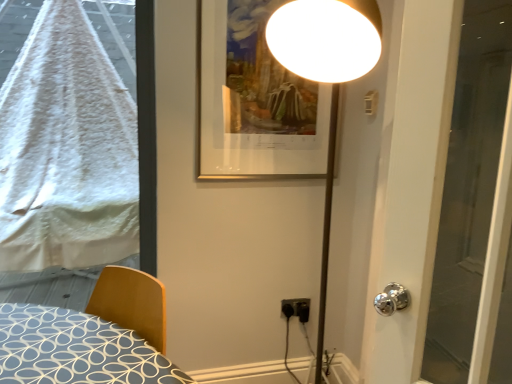
Where is `white fluffy blanket at left`? This screenshot has width=512, height=384. white fluffy blanket at left is located at coordinates (66, 150).

Describe the element at coordinates (254, 100) in the screenshot. I see `gold metallic picture frame at upper center` at that location.

I want to click on transparent glass door at right, so click(469, 188).

From a real-world perspective, is gold metallic picture frame at upper center on white fluffy blanket at left?

Yes.

Which is nearer, (310,114) or (21,263)?

Clearly, point (310,114) is closer to the camera than point (21,263).

Which of these two, gold metallic picture frame at upper center or white fluffy blanket at left, is thinner?

gold metallic picture frame at upper center is thinner.

Is gold metallic picture frame at upper center bigger than white fluffy blanket at left?

Actually, gold metallic picture frame at upper center might be smaller than white fluffy blanket at left.

From the image's perspective, is black plastic electric outlet at lower center positioned above or below wooden bed at lower left?

From the image's perspective, black plastic electric outlet at lower center appears below wooden bed at lower left.

Is black plastic electric outlet at lower center far from wooden bed at lower left?

black plastic electric outlet at lower center is positioned a significant distance from wooden bed at lower left.

What are the coordinates of `bed above the black plastic electric outlet at lower center (from a real-world perspective)` in the screenshot? It's located at (x=91, y=336).

Which point is more distant from viewer, (308, 307) or (182, 372)?

Point (308, 307)

Find the location of a particular element. This screenshot has width=512, height=384. blanket above the wooden bed at lower left (from a real-world perspective) is located at coordinates (66, 150).

Is white fluffy blanket at left aimed at wooden bed at lower left?

Yes, white fluffy blanket at left is turned towards wooden bed at lower left.

Between point (56, 67) and point (175, 373), which one is positioned in front?

The point (175, 373) is closer to the camera.

What's the angular difference between white fluffy blanket at left and wooden bed at lower left's facing directions?

They differ by 46.7 degrees in their facing directions.

Between point (477, 191) and point (292, 305), which one is positioned behind?

The point (292, 305) is farther.

From the picture: Would you say transparent glass door at right is outside black plastic electric outlet at lower center?

Yes, transparent glass door at right is outside of black plastic electric outlet at lower center.

Considering the relative sizes of transparent glass door at right and black plastic electric outlet at lower center in the image provided, is transparent glass door at right shorter than black plastic electric outlet at lower center?

Incorrect, the height of transparent glass door at right does not fall short of that of black plastic electric outlet at lower center.

Between transparent glass door at right and black plastic electric outlet at lower center, which one has smaller size?

black plastic electric outlet at lower center is smaller.

What's the angular difference between gold metallic picture frame at upper center and transparent glass door at right's facing directions?

96.7 degrees.

Is gold metallic picture frame at upper center to the left of transparent glass door at right from the viewer's perspective?

Indeed, gold metallic picture frame at upper center is positioned on the left side of transparent glass door at right.

Which is in front, point (309, 134) or point (460, 273)?

The point (460, 273) is in front.

Is gold metallic picture frame at upper center looking in the opposite direction of transparent glass door at right?

gold metallic picture frame at upper center is not turned away from transparent glass door at right.

What's the angular difference between white fluffy blanket at left and transparent glass door at right's facing directions?

white fluffy blanket at left and transparent glass door at right are facing 96.2 degrees away from each other.

Looking at this image, from the image's perspective, is white fluffy blanket at left located beneath transparent glass door at right?

No.

Who is smaller, white fluffy blanket at left or transparent glass door at right?

transparent glass door at right.

Considering the relative sizes of white fluffy blanket at left and transparent glass door at right in the image provided, is white fluffy blanket at left shorter than transparent glass door at right?

In fact, white fluffy blanket at left may be taller than transparent glass door at right.

I want to click on picture frame on the right of white fluffy blanket at left, so click(x=254, y=100).

Is gold metallic picture frame at upper center at the back of white fluffy blanket at left?

No.

Is white fluffy blanket at left inside or outside of gold metallic picture frame at upper center?

white fluffy blanket at left is outside gold metallic picture frame at upper center.

Where is `blanket that appears below the gold metallic picture frame at upper center (from the image's perspective)`? The height and width of the screenshot is (384, 512). blanket that appears below the gold metallic picture frame at upper center (from the image's perspective) is located at coordinates (66, 150).

Image resolution: width=512 pixels, height=384 pixels. What are the coordinates of `bed in front of the black plastic electric outlet at lower center` in the screenshot? It's located at (91, 336).

Based on their spatial positions, is wooden bed at lower left or gold metallic picture frame at upper center closer to transparent glass door at right?

Based on the image, gold metallic picture frame at upper center appears to be nearer to transparent glass door at right.

Which object lies nearer to the anchor point wooden bed at lower left, gold metallic picture frame at upper center or white fluffy blanket at left?

gold metallic picture frame at upper center.

Estimate the real-world distances between objects in this image. Which object is further from transparent glass door at right, black plastic electric outlet at lower center or white fluffy blanket at left?

white fluffy blanket at left is further to transparent glass door at right.

Estimate the real-world distances between objects in this image. Which object is further from white fluffy blanket at left, transparent glass door at right or gold metallic picture frame at upper center?

The object further to white fluffy blanket at left is transparent glass door at right.

From the image, which object appears to be farther from wooden bed at lower left, white fluffy blanket at left or transparent glass door at right?

white fluffy blanket at left is positioned further to the anchor wooden bed at lower left.

Considering their positions, is transparent glass door at right positioned further to gold metallic picture frame at upper center than black plastic electric outlet at lower center?

black plastic electric outlet at lower center.

Estimate the real-world distances between objects in this image. Which object is further from gold metallic picture frame at upper center, black plastic electric outlet at lower center or wooden bed at lower left?

Based on the image, black plastic electric outlet at lower center appears to be further to gold metallic picture frame at upper center.

When comparing their distances from transparent glass door at right, does white fluffy blanket at left or gold metallic picture frame at upper center seem further?

white fluffy blanket at left.

Locate an element on the screen. The image size is (512, 384). bed situated between white fluffy blanket at left and transparent glass door at right from left to right is located at coordinates (91, 336).

Find the location of a particular element. The width and height of the screenshot is (512, 384). picture frame between wooden bed at lower left and black plastic electric outlet at lower center along the z-axis is located at coordinates (254, 100).

Image resolution: width=512 pixels, height=384 pixels. I want to click on picture frame located between transparent glass door at right and black plastic electric outlet at lower center in the depth direction, so click(x=254, y=100).

This screenshot has height=384, width=512. I want to click on electric outlet between white fluffy blanket at left and transparent glass door at right in the horizontal direction, so click(x=296, y=308).